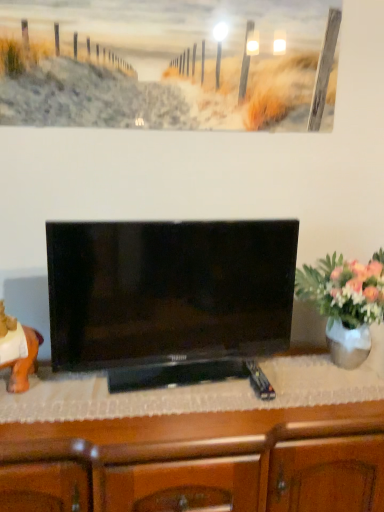
Question: Is wooden cabinet at center facing away from black glossy tv at center?

Choices:
 (A) yes
 (B) no

Answer: (B)

Question: Considering the relative sizes of wooden cabinet at center and black glossy tv at center in the image provided, is wooden cabinet at center smaller than black glossy tv at center?

Choices:
 (A) yes
 (B) no

Answer: (B)

Question: From the image's perspective, would you say wooden cabinet at center is shown under black glossy tv at center?

Choices:
 (A) no
 (B) yes

Answer: (B)

Question: Is wooden cabinet at center further to the viewer compared to black glossy tv at center?

Choices:
 (A) yes
 (B) no

Answer: (B)

Question: Are wooden cabinet at center and black glossy tv at center located far from each other?

Choices:
 (A) no
 (B) yes

Answer: (A)

Question: Is wooden cabinet at center surrounding black glossy tv at center?

Choices:
 (A) no
 (B) yes

Answer: (A)

Question: Considering the relative sizes of white glossy vase at right and wooden cabinet at center in the image provided, is white glossy vase at right shorter than wooden cabinet at center?

Choices:
 (A) yes
 (B) no

Answer: (A)

Question: Does white glossy vase at right have a greater width compared to wooden cabinet at center?

Choices:
 (A) yes
 (B) no

Answer: (B)

Question: Could you tell me if white glossy vase at right is turned towards wooden cabinet at center?

Choices:
 (A) yes
 (B) no

Answer: (B)

Question: Is white glossy vase at right at the right side of wooden cabinet at center?

Choices:
 (A) yes
 (B) no

Answer: (A)

Question: Is white glossy vase at right further to the viewer compared to wooden cabinet at center?

Choices:
 (A) no
 (B) yes

Answer: (B)

Question: Can you confirm if white glossy vase at right is positioned to the left of wooden cabinet at center?

Choices:
 (A) no
 (B) yes

Answer: (A)

Question: From a real-world perspective, is orange matte statue at left positioned over black glossy tv at center based on gravity?

Choices:
 (A) yes
 (B) no

Answer: (B)